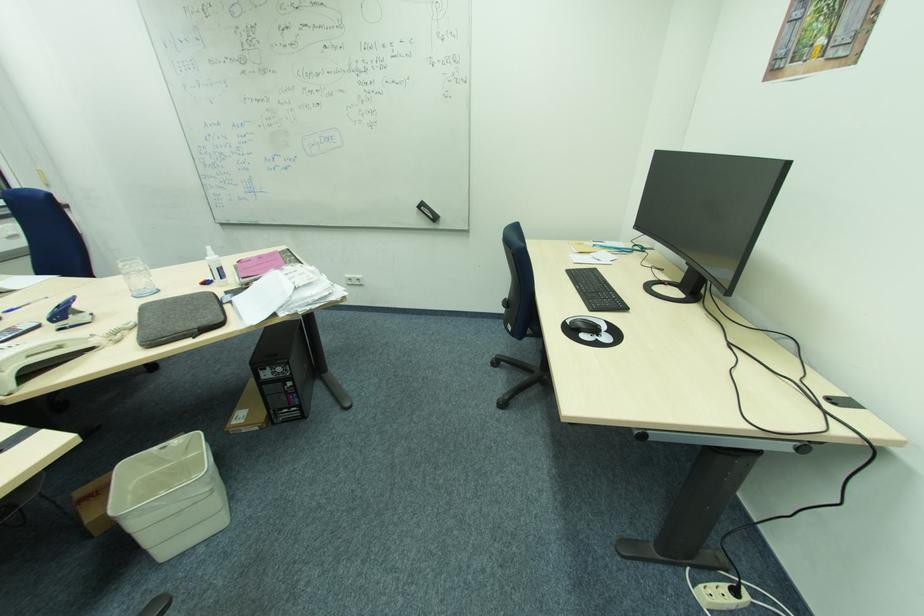
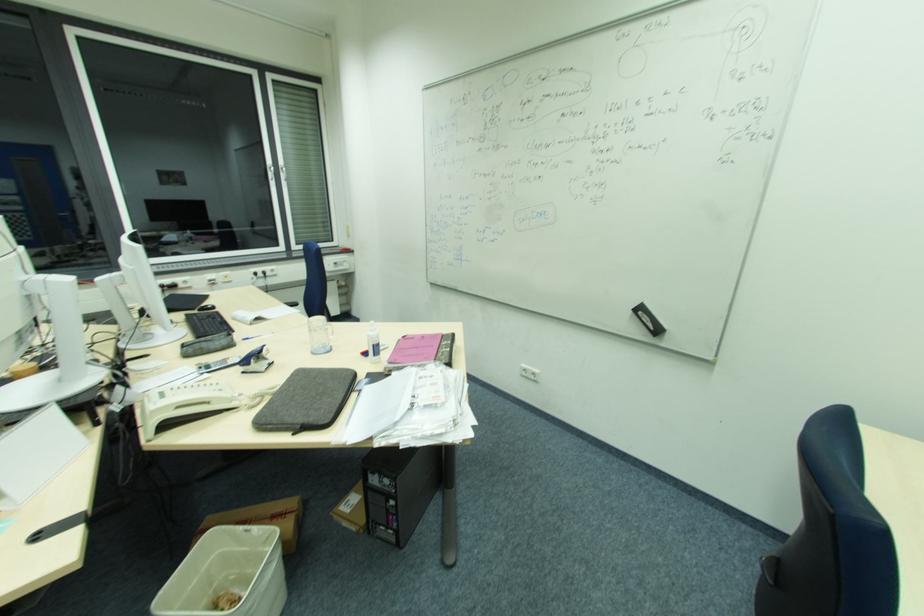
Question: The camera is either moving clockwise (left) or counter-clockwise (right) around the object. The first image is from the beginning of the video and the second image is from the end. Is the camera moving left or right when shooting the video?

Choices:
 (A) Left
 (B) Right

Answer: (B)